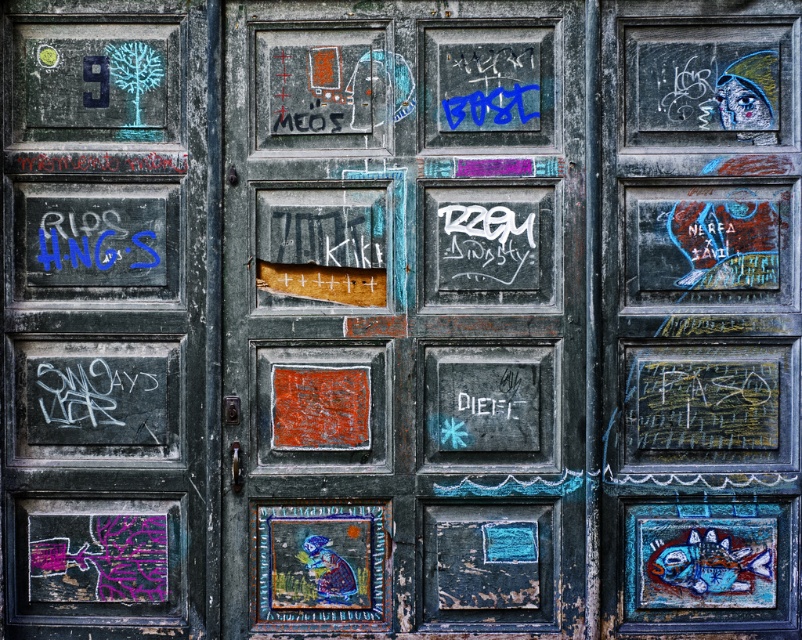
You are standing in front of a door complex with two doors. You need to find the taller door between the rusty metal door at center and the chalky green door at left. Which one is taller?

The chalky green door at left is taller than the rusty metal door at center according to the description.

You are standing at the camera position and want to reach the point marked at coordinates [470,38] on the weathered dark green door. Is this point within arm reach from your current position?

The point at [470,38] is 16.70 feet away from the camera, which is much farther than an average person can reach with their arm. You would need to move closer or use a tool to reach it.

You are a painter planning to restore two doors in a historic building. The doors are the rusty metal door at center and the chalky green door at left. Based on their sizes, which door would require more paint?

The rusty metal door at center requires more paint because it is larger in size than the chalky green door at left.